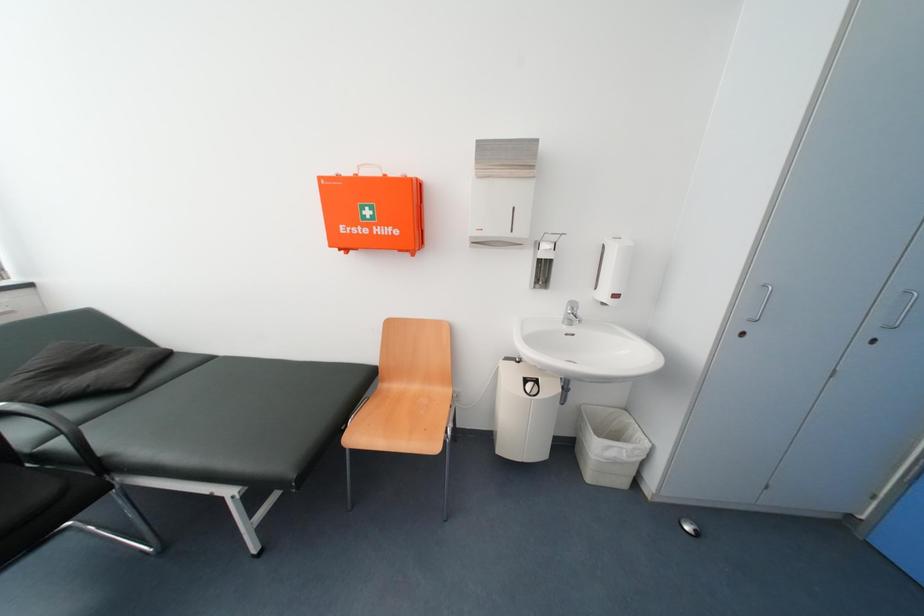
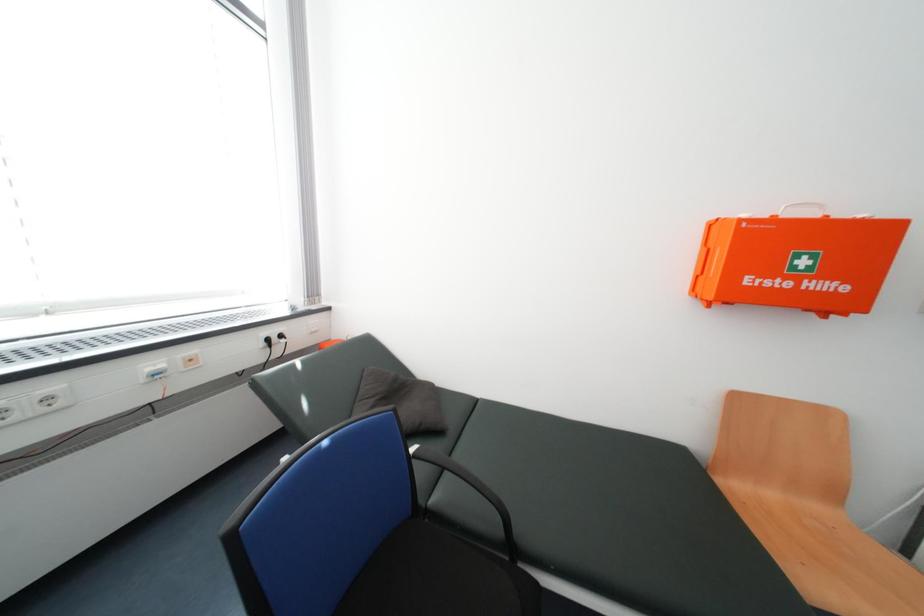
Question: The images are taken continuously from a first-person perspective. In which direction are you moving?

Choices:
 (A) Left
 (B) Right
 (C) Forward
 (D) Backward

Answer: (A)